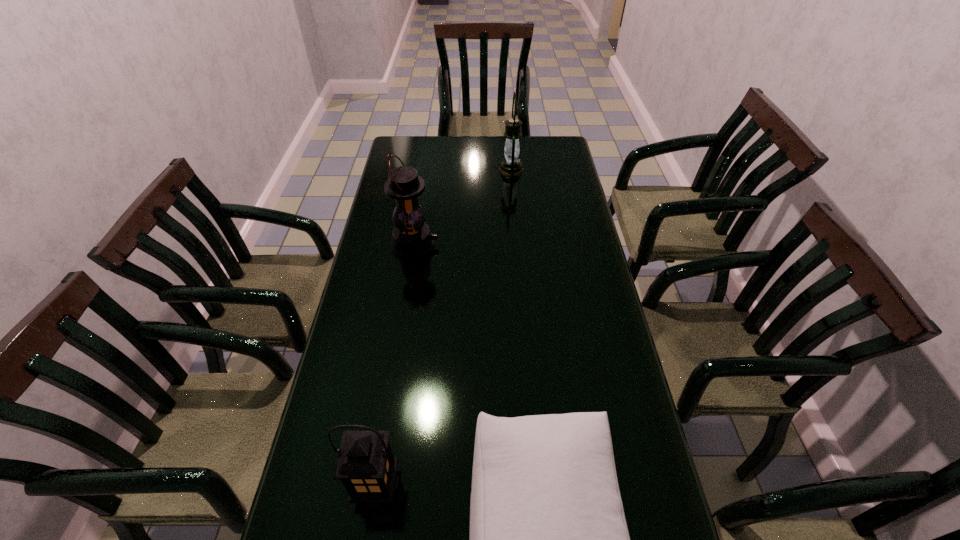
Locate an element on the screen. Image resolution: width=960 pixels, height=540 pixels. the second farthest object is located at coordinates (412, 239).

In order to click on the farthest object in this screenshot , I will do `click(511, 166)`.

Image resolution: width=960 pixels, height=540 pixels. Identify the location of the rightmost lantern. (511, 166).

Find the location of a particular element. The image size is (960, 540). the nearest lantern is located at coordinates (365, 465).

Pinpoint the vacant space located above the third nearest object, indicating its light source. Please provide its 2D coordinates. Your answer should be formatted as a tuple, i.e. [(x, y)], where the tuple contains the x and y coordinates of a point satisfying the conditions above.

[(510, 245)]

The height and width of the screenshot is (540, 960). Identify the location of vacant space situated 0.120m on the side where the farthest object emits light. (469, 170).

This screenshot has height=540, width=960. In order to click on vacant position located 0.370m on the side where the farthest object emits light in this screenshot , I will do click(411, 170).

The height and width of the screenshot is (540, 960). What are the coordinates of `vacant area situated on the side where the farthest object emits light` in the screenshot? It's located at (444, 170).

Find the location of a particular element. free region located 0.330m on the back of the shortest lantern is located at coordinates [398, 345].

I want to click on object located in the far edge section of the desktop, so click(511, 166).